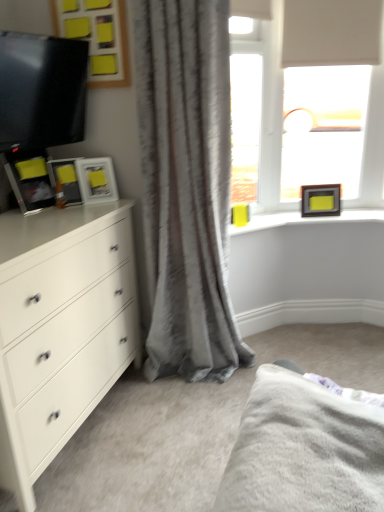
Question: From the image's perspective, is white matte window at upper right located beneath matte black picture frame at left, which is the 2th picture frame from right to left?

Choices:
 (A) yes
 (B) no

Answer: (B)

Question: Is white matte window at upper right smaller than matte black picture frame at left, which appears as the 2th picture frame when viewed from the back?

Choices:
 (A) no
 (B) yes

Answer: (A)

Question: Does white matte window at upper right have a greater height compared to matte black picture frame at left, which appears as the 2th picture frame when viewed from the back?

Choices:
 (A) yes
 (B) no

Answer: (A)

Question: Is white matte window at upper right at the right side of matte black picture frame at left, which is the 2th picture frame from right to left?

Choices:
 (A) no
 (B) yes

Answer: (B)

Question: From a real-world perspective, is white matte window at upper right over matte black picture frame at left, which is counted as the second picture frame, starting from the left?

Choices:
 (A) yes
 (B) no

Answer: (A)

Question: Is white matte window at upper right surrounding matte black picture frame at left, which appears as the 2th picture frame when viewed from the back?

Choices:
 (A) yes
 (B) no

Answer: (B)

Question: Can you confirm if white matte window at upper right is positioned to the left of gray textured curtain at center?

Choices:
 (A) yes
 (B) no

Answer: (B)

Question: Considering the relative sizes of white matte window at upper right and gray textured curtain at center in the image provided, is white matte window at upper right wider than gray textured curtain at center?

Choices:
 (A) no
 (B) yes

Answer: (A)

Question: From a real-world perspective, is white matte window at upper right below gray textured curtain at center?

Choices:
 (A) yes
 (B) no

Answer: (B)

Question: From the image's perspective, is white matte window at upper right located beneath gray textured curtain at center?

Choices:
 (A) no
 (B) yes

Answer: (A)

Question: Considering the relative sizes of white matte window at upper right and gray textured curtain at center in the image provided, is white matte window at upper right thinner than gray textured curtain at center?

Choices:
 (A) yes
 (B) no

Answer: (A)

Question: From the image's perspective, is white matte window at upper right located above gray textured curtain at center?

Choices:
 (A) no
 (B) yes

Answer: (B)

Question: From the image's perspective, is white matte chest of drawers at left above gray textured curtain at center?

Choices:
 (A) yes
 (B) no

Answer: (B)